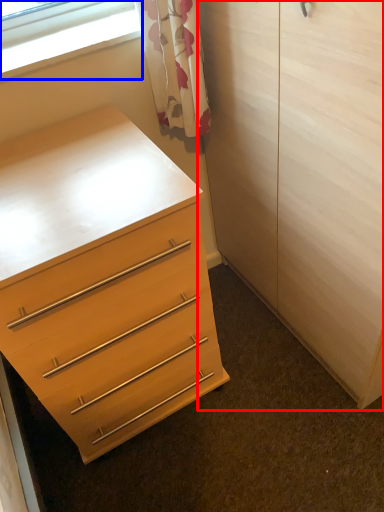
Question: Which point is further to the camera, armoire (highlighted by a red box) or window (highlighted by a blue box)?

Choices:
 (A) armoire
 (B) window

Answer: (B)